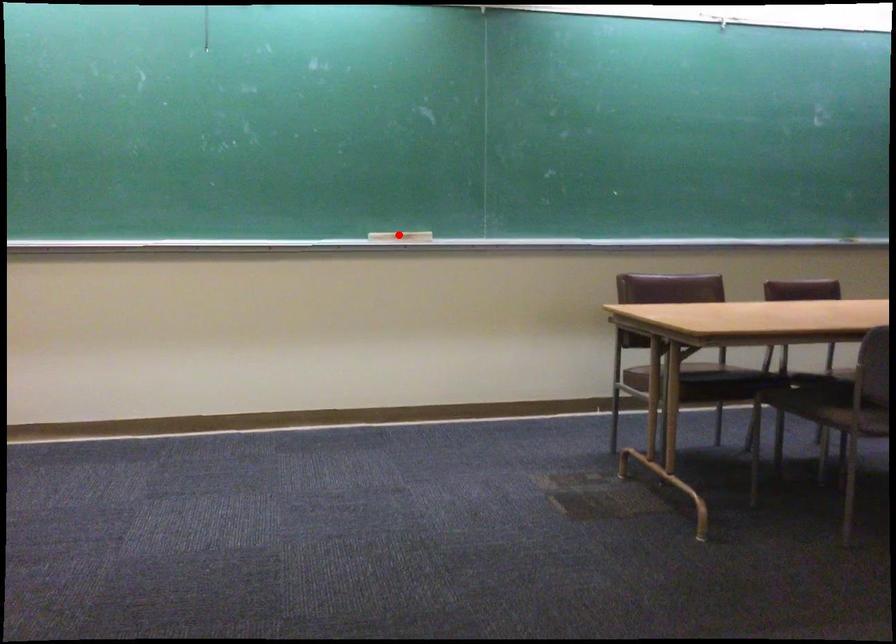
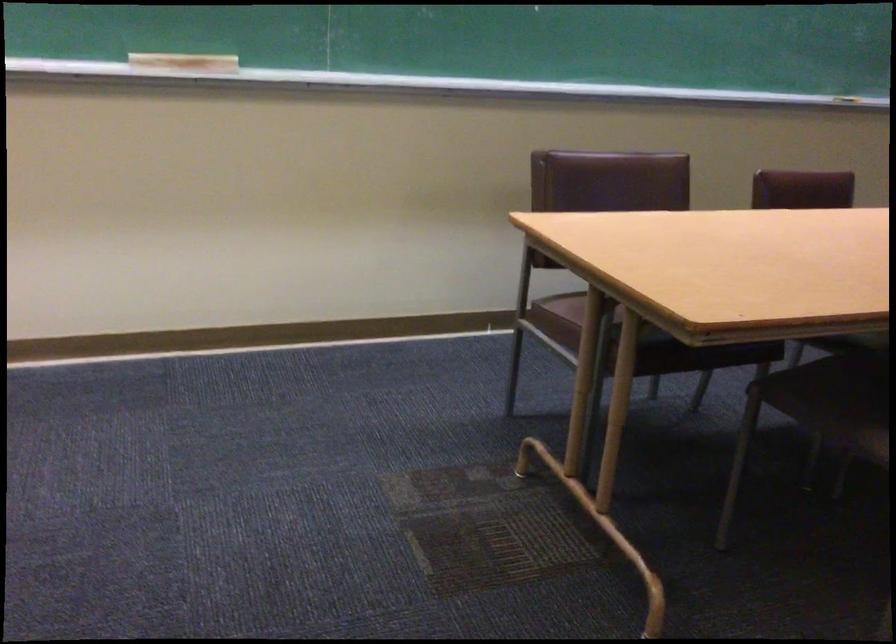
Question: I am providing you with two images of the same scene from different viewpoints. Given a red point in image1, look at the same physical point in image2. Is it:

Choices:
 (A) Closer to the viewpoint
 (B) Farther from the viewpoint

Answer: (A)